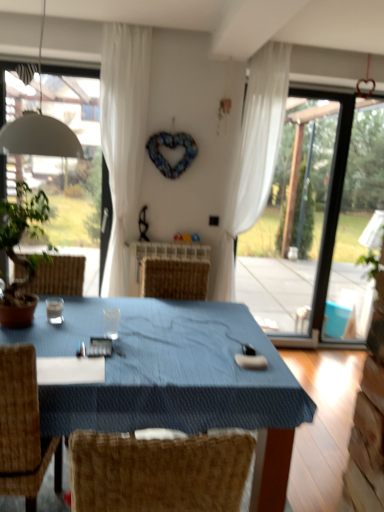
What do you see at coordinates (111, 322) in the screenshot? This screenshot has width=384, height=512. I see `transparent glass coffee cup at center` at bounding box center [111, 322].

Measure the distance between blue fabric table at center and camera.

blue fabric table at center is 1.63 meters away from camera.

This screenshot has height=512, width=384. Describe the element at coordinates (254, 155) in the screenshot. I see `white sheer curtain at upper center, the first curtain positioned from the right` at that location.

Image resolution: width=384 pixels, height=512 pixels. Identify the location of white sheer curtain at center, which appears as the 1th curtain when viewed from the left. (123, 138).

Locate an element on the screen. The width and height of the screenshot is (384, 512). woven wood chair at lower left is located at coordinates click(23, 429).

Locate an element on the screen. transparent glass coffee cup at center is located at coordinates (111, 322).

Does white sheer curtain at upper center, the first curtain positioned from the right, appear on the right side of white sheer curtain at center, which appears as the 1th curtain when viewed from the left?

Indeed, white sheer curtain at upper center, the first curtain positioned from the right, is positioned on the right side of white sheer curtain at center, which appears as the 1th curtain when viewed from the left.

Between white sheer curtain at upper center, the first curtain positioned from the right, and white sheer curtain at center, which appears as the 1th curtain when viewed from the left, which one has smaller size?

With smaller size is white sheer curtain at upper center, the first curtain positioned from the right.

Is white sheer curtain at upper center, the first curtain positioned from the right, facing away from white sheer curtain at center, the second curtain in the right-to-left sequence?

No.

Is white sheer curtain at center, which appears as the 1th curtain when viewed from the left, turned away from green leafy plant at left?

That's not correct — white sheer curtain at center, which appears as the 1th curtain when viewed from the left, is not looking away from green leafy plant at left.

Can you tell me how much white sheer curtain at center, the second curtain in the right-to-left sequence, and green leafy plant at left differ in facing direction?

They differ by 11.2 degrees in their facing directions.

Are white sheer curtain at center, which appears as the 1th curtain when viewed from the left, and green leafy plant at left far apart?

Yes, white sheer curtain at center, which appears as the 1th curtain when viewed from the left, and green leafy plant at left are located far from each other.

Where is `houseplant in front of the white sheer curtain at center, which appears as the 1th curtain when viewed from the left`? Image resolution: width=384 pixels, height=512 pixels. houseplant in front of the white sheer curtain at center, which appears as the 1th curtain when viewed from the left is located at coordinates (22, 256).

In the scene shown: Based on their sizes in the image, would you say white sheer curtain at center, the second curtain in the right-to-left sequence, is bigger or smaller than woven wood chair at lower left?

In the image, white sheer curtain at center, the second curtain in the right-to-left sequence, appears to be smaller than woven wood chair at lower left.

Which is more to the right, white sheer curtain at center, which appears as the 1th curtain when viewed from the left, or woven wood chair at lower left?

From the viewer's perspective, white sheer curtain at center, which appears as the 1th curtain when viewed from the left, appears more on the right side.

Does point (114, 226) come in front of point (26, 482)?

No, it is behind (26, 482).

Is white sheer curtain at center, which appears as the 1th curtain when viewed from the left, looking in the opposite direction of woven wood chair at lower left?

That's not correct — white sheer curtain at center, which appears as the 1th curtain when viewed from the left, is not looking away from woven wood chair at lower left.

Based on the photo, is green leafy plant at left wider than white sheer curtain at upper center, the 2th curtain from the left?

Yes, green leafy plant at left is wider than white sheer curtain at upper center, the 2th curtain from the left.

From the image's perspective, is green leafy plant at left above or below white sheer curtain at upper center, the 2th curtain from the left?

Based on their image positions, green leafy plant at left is located beneath white sheer curtain at upper center, the 2th curtain from the left.

Is green leafy plant at left turned away from white sheer curtain at upper center, the first curtain positioned from the right?

No, white sheer curtain at upper center, the first curtain positioned from the right, is not at the back of green leafy plant at left.

Can you tell me how much green leafy plant at left and white sheer curtain at upper center, the first curtain positioned from the right, differ in facing direction?

There is a 8.25-degree angle between the facing directions of green leafy plant at left and white sheer curtain at upper center, the first curtain positioned from the right.

Considering the positions of point (232, 426) and point (31, 490), is point (232, 426) closer or farther from the camera than point (31, 490)?

Point (232, 426) appears to be farther away from the viewer than point (31, 490).

Is blue fabric table at center looking in the opposite direction of woven wood chair at lower left?

blue fabric table at center is not turned away from woven wood chair at lower left.

In the image, is blue fabric table at center positioned in front of or behind woven wood chair at lower left?

blue fabric table at center is in front of woven wood chair at lower left.

How many degrees apart are the facing directions of blue fabric table at center and woven wood chair at lower left?

The angle between the facing direction of blue fabric table at center and the facing direction of woven wood chair at lower left is 0.000279 degrees.

Where is `houseplant that is above the blue fabric table at center (from the image's perspective)`? houseplant that is above the blue fabric table at center (from the image's perspective) is located at coordinates (22, 256).

Does green leafy plant at left turn towards blue fabric table at center?

No, green leafy plant at left is not turned towards blue fabric table at center.

Looking at their sizes, would you say green leafy plant at left is wider or thinner than blue fabric table at center?

In the image, green leafy plant at left appears to be more narrow than blue fabric table at center.

Considering the sizes of objects green leafy plant at left and blue fabric table at center in the image provided, who is bigger, green leafy plant at left or blue fabric table at center?

Bigger between the two is blue fabric table at center.

Is blue fabric table at center thinner than white sheer curtain at upper center, the first curtain positioned from the right?

No.

Is blue fabric table at center not near white sheer curtain at upper center, the first curtain positioned from the right?

That's right, there is a large distance between blue fabric table at center and white sheer curtain at upper center, the first curtain positioned from the right.

Between point (52, 355) and point (261, 156), which one is positioned in front?

Point (52, 355)

Find the location of a particular element. This screenshot has height=512, width=384. curtain below the white sheer curtain at center, which appears as the 1th curtain when viewed from the left (from a real-world perspective) is located at coordinates (254, 155).

Find the location of a particular element. This screenshot has width=384, height=512. houseplant on the left of white sheer curtain at center, which appears as the 1th curtain when viewed from the left is located at coordinates (22, 256).

Based on their spatial positions, is blue fabric table at center or white sheer curtain at center, the second curtain in the right-to-left sequence, closer to green leafy plant at left?

blue fabric table at center is positioned closer to the anchor green leafy plant at left.

Considering their positions, is green leafy plant at left positioned closer to blue fabric table at center than white matte lampshade at upper left?

green leafy plant at left is closer to blue fabric table at center.

Looking at the image, which one is located further to transparent glass coffee cup at center, white matte lampshade at upper left or green leafy plant at left?

white matte lampshade at upper left is further to transparent glass coffee cup at center.

Looking at the image, which one is located further to white sheer curtain at upper center, the 2th curtain from the left, white sheer curtain at center, the second curtain in the right-to-left sequence, or transparent glass coffee cup at center?

transparent glass coffee cup at center lies further to white sheer curtain at upper center, the 2th curtain from the left, than the other object.

Looking at the image, which one is located closer to transparent glass coffee cup at center, blue fabric table at center or white sheer curtain at center, the second curtain in the right-to-left sequence?

blue fabric table at center is positioned closer to the anchor transparent glass coffee cup at center.

Estimate the real-world distances between objects in this image. Which object is closer to blue fabric table at center, white sheer curtain at center, the second curtain in the right-to-left sequence, or white matte lampshade at upper left?

white matte lampshade at upper left.

Looking at the image, which one is located further to white matte lampshade at upper left, green leafy plant at left or blue fabric table at center?

Based on the image, blue fabric table at center appears to be further to white matte lampshade at upper left.

Based on their spatial positions, is white matte lampshade at upper left or woven wood chair at lower left closer to white sheer curtain at center, which appears as the 1th curtain when viewed from the left?

The object closer to white sheer curtain at center, which appears as the 1th curtain when viewed from the left, is white matte lampshade at upper left.

Identify the location of houseplant located between woven wood chair at lower left and white sheer curtain at upper center, the first curtain positioned from the right, in the depth direction. (22, 256).

Where is `houseplant that lies between white matte lampshade at upper left and transparent glass coffee cup at center from top to bottom`? The image size is (384, 512). houseplant that lies between white matte lampshade at upper left and transparent glass coffee cup at center from top to bottom is located at coordinates (22, 256).

I want to click on curtain between green leafy plant at left and white sheer curtain at upper center, the 2th curtain from the left, so click(x=123, y=138).

Image resolution: width=384 pixels, height=512 pixels. In order to click on houseplant between white matte lampshade at upper left and blue fabric table at center from top to bottom in this screenshot , I will do `click(22, 256)`.